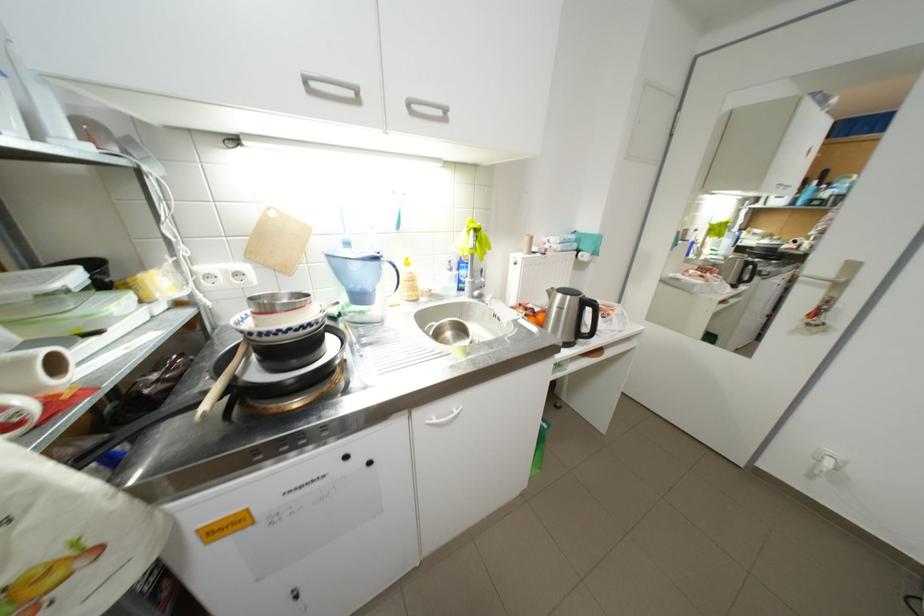
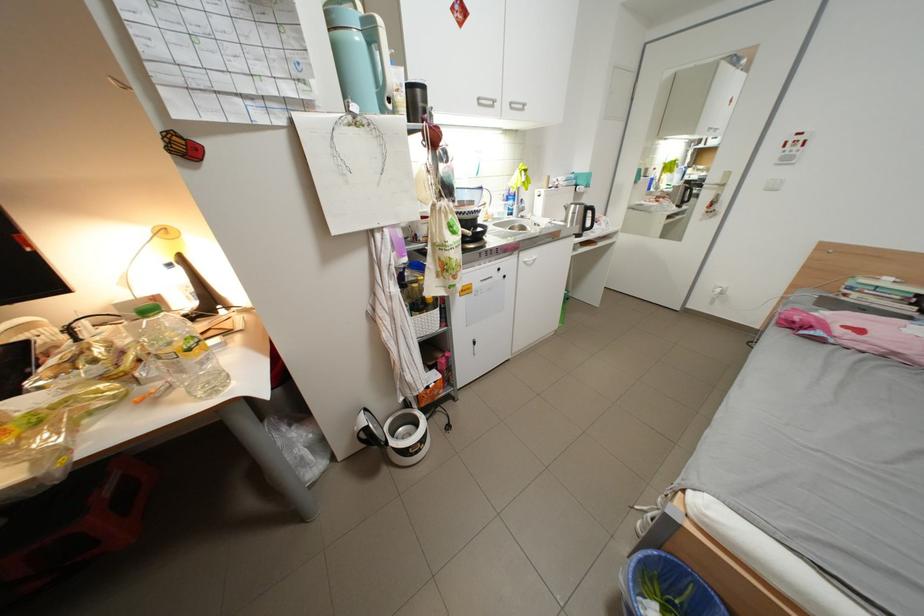
In the second image, find the point that corresponds to pixel 317 79 in the first image.

(490, 100)